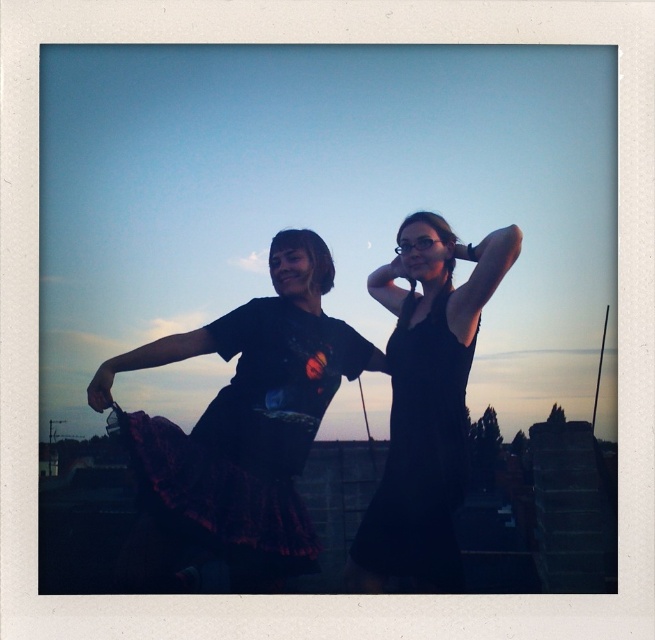
Question: Which of the following is the closest to the observer?

Choices:
 (A) black matte dress at center
 (B) black satin dress at center

Answer: (A)

Question: Is black satin dress at center thinner than black matte dress at center?

Choices:
 (A) yes
 (B) no

Answer: (B)

Question: Which point is closer to the camera taking this photo?

Choices:
 (A) (157, 417)
 (B) (457, 246)

Answer: (B)

Question: Does black satin dress at center have a lesser width compared to black matte dress at center?

Choices:
 (A) yes
 (B) no

Answer: (B)

Question: Which of the following is the farthest from the observer?

Choices:
 (A) black matte dress at center
 (B) black satin dress at center

Answer: (B)

Question: Can you confirm if black satin dress at center is smaller than black matte dress at center?

Choices:
 (A) yes
 (B) no

Answer: (A)